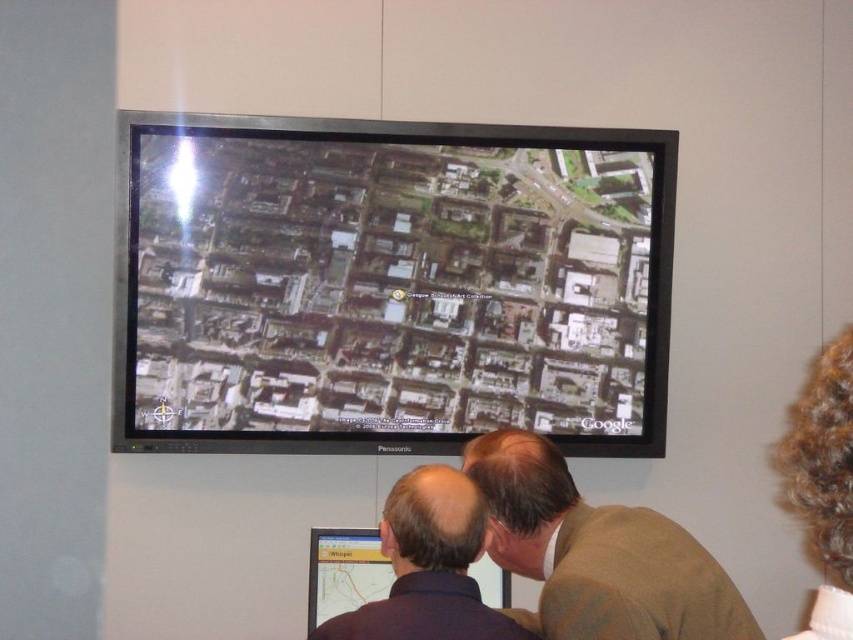
Is brown wool sweater at lower right to the left of brown hair at lower center from the viewer's perspective?

Correct, you'll find brown wool sweater at lower right to the left of brown hair at lower center.

Which is below, brown wool sweater at lower right or brown hair at lower center?

brown hair at lower center

Is point (491, 467) closer to camera compared to point (846, 508)?

No, it is behind (846, 508).

Locate an element on the screen. This screenshot has height=640, width=853. brown wool sweater at lower right is located at coordinates (596, 554).

Is point (583, 552) behind point (405, 577)?

Yes.

Does brown wool sweater at lower right have a smaller size compared to dark blue shirt at lower center?

No, brown wool sweater at lower right is not smaller than dark blue shirt at lower center.

Describe the element at coordinates (596, 554) in the screenshot. I see `brown wool sweater at lower right` at that location.

Find the location of `brown wool sweater at lower right`. brown wool sweater at lower right is located at coordinates (596, 554).

Does satellite map at center appear on the right side of dark blue shirt at lower center?

Incorrect, satellite map at center is not on the right side of dark blue shirt at lower center.

Between satellite map at center and dark blue shirt at lower center, which one appears on the left side from the viewer's perspective?

From the viewer's perspective, satellite map at center appears more on the left side.

Between point (410, 362) and point (456, 598), which one is positioned behind?

Positioned behind is point (410, 362).

Identify the location of satellite map at center. This screenshot has width=853, height=640. (389, 284).